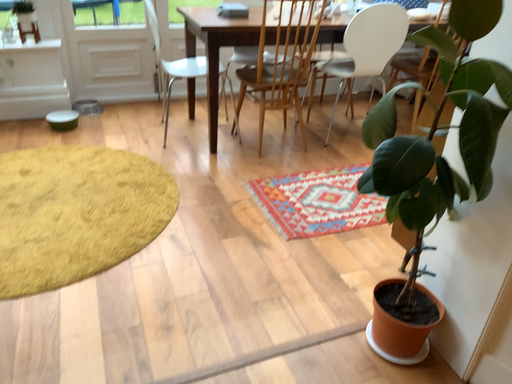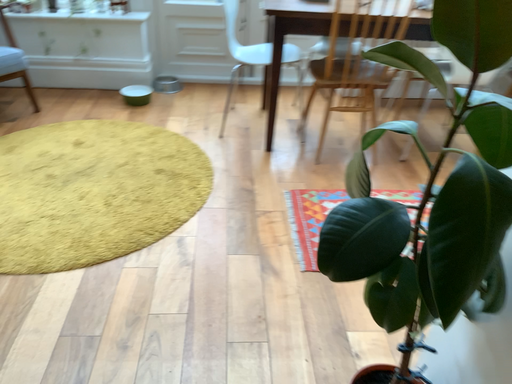
Question: How did the camera likely rotate when shooting the video?

Choices:
 (A) rotated left
 (B) rotated right

Answer: (A)